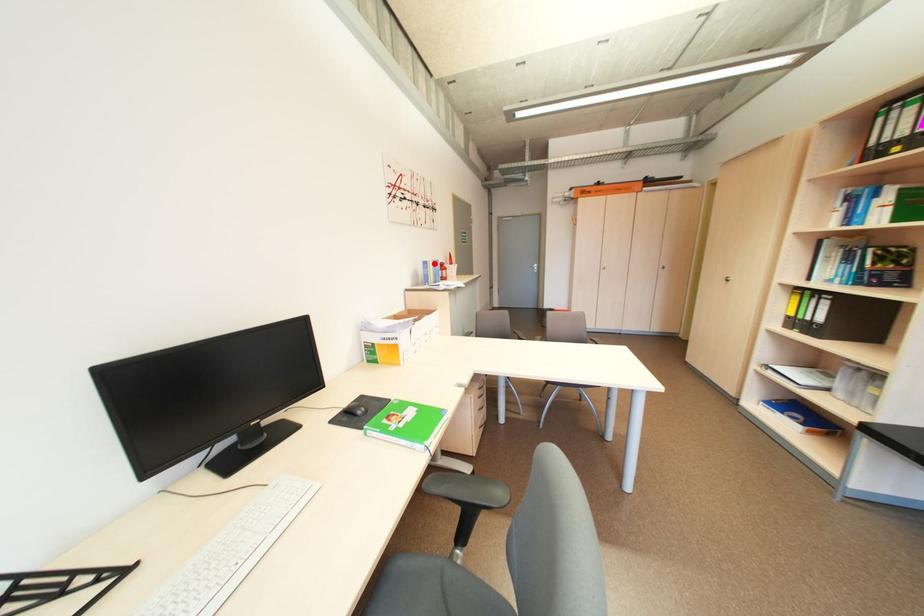
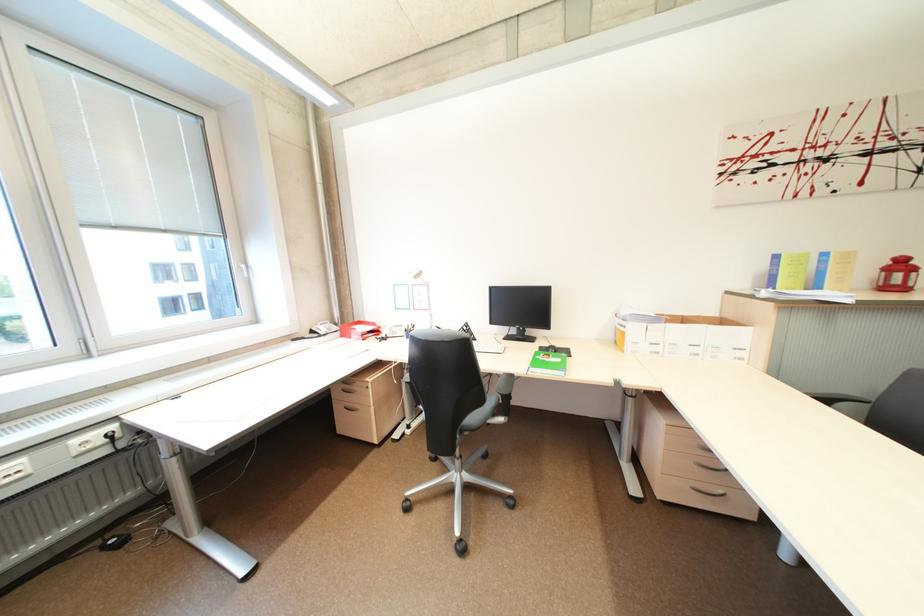
Where in the second image is the point corresponding to the highlighted location from the first image?

(785, 257)